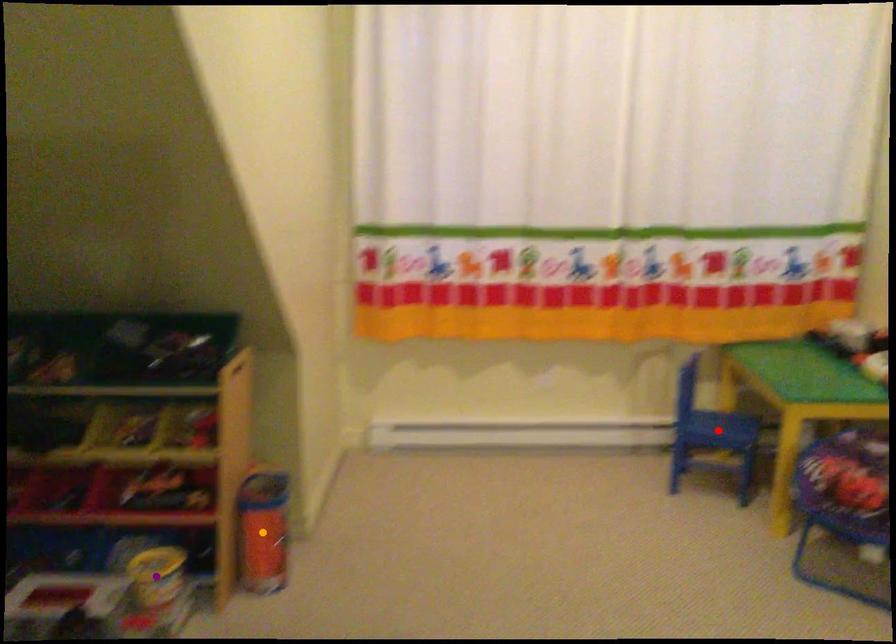
Order these from nearest to farthest:
A) red point
B) orange point
C) purple point

purple point < orange point < red point